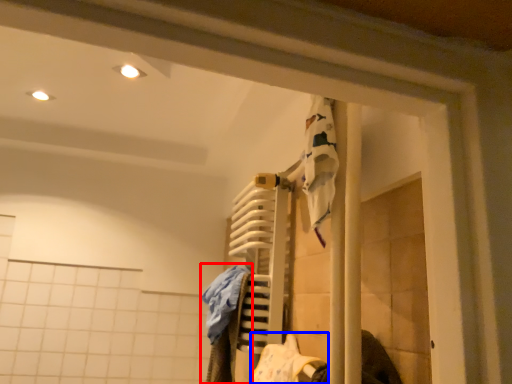
Question: Which object is further to the camera taking this photo, clothing (highlighted by a red box) or clothing (highlighted by a blue box)?

Choices:
 (A) clothing
 (B) clothing

Answer: (A)